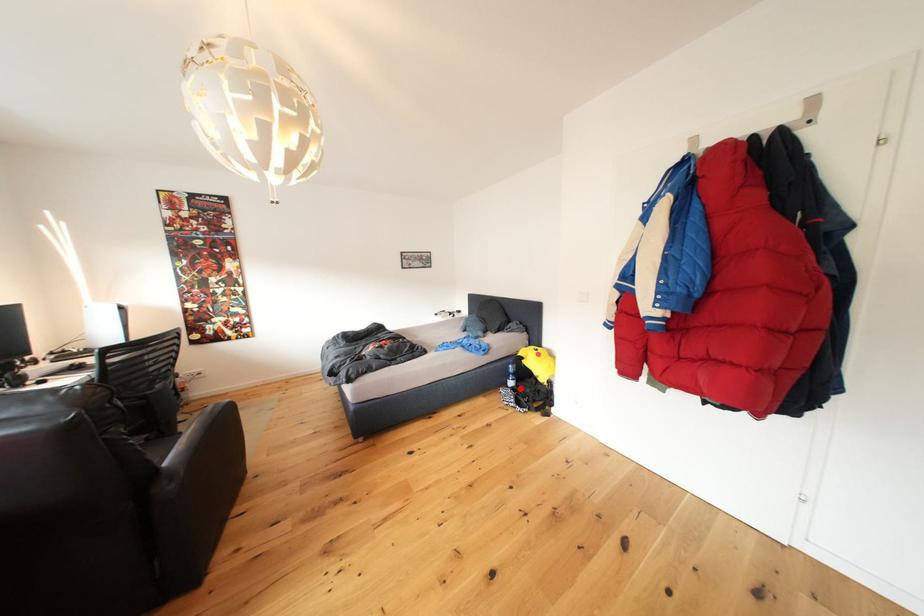
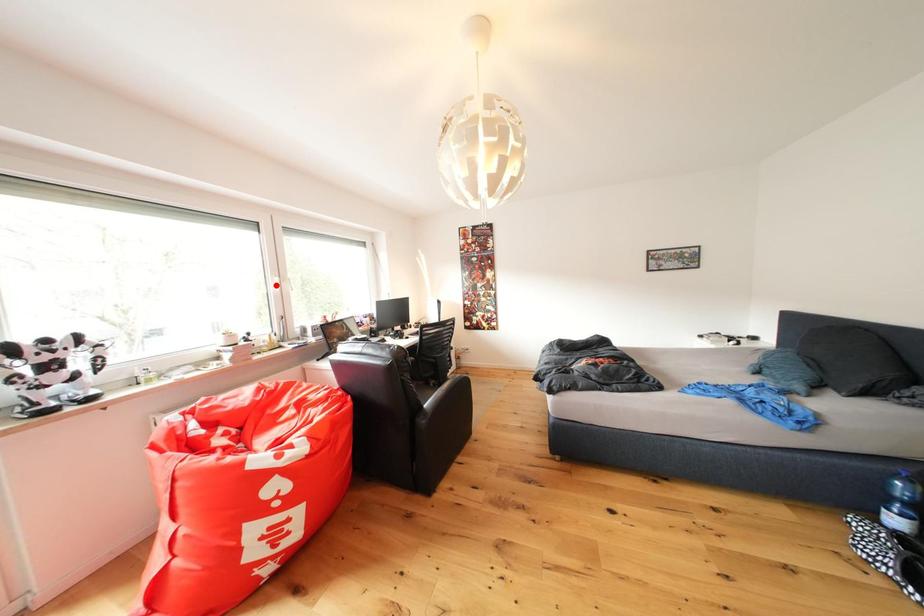
I am providing you with two images of the same scene from different viewpoints. A red point is marked on the first image and another point is marked on the second image. Are the points marked in image1 and image2 representing the same 3D position?

No